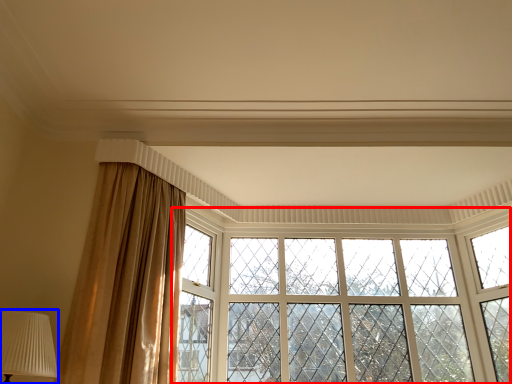
Question: Which object appears farthest to the camera in this image, window (highlighted by a red box) or table lamp (highlighted by a blue box)?

Choices:
 (A) window
 (B) table lamp

Answer: (A)